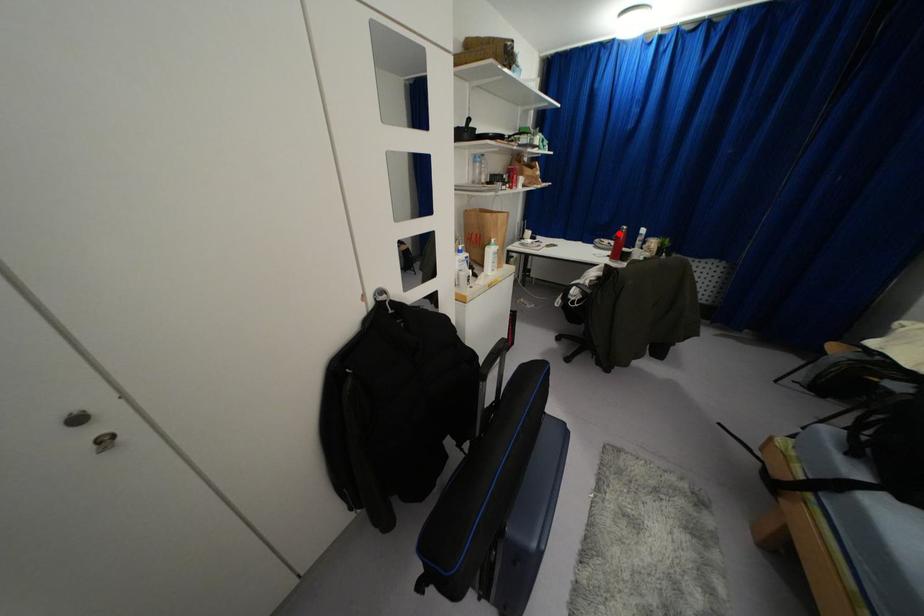
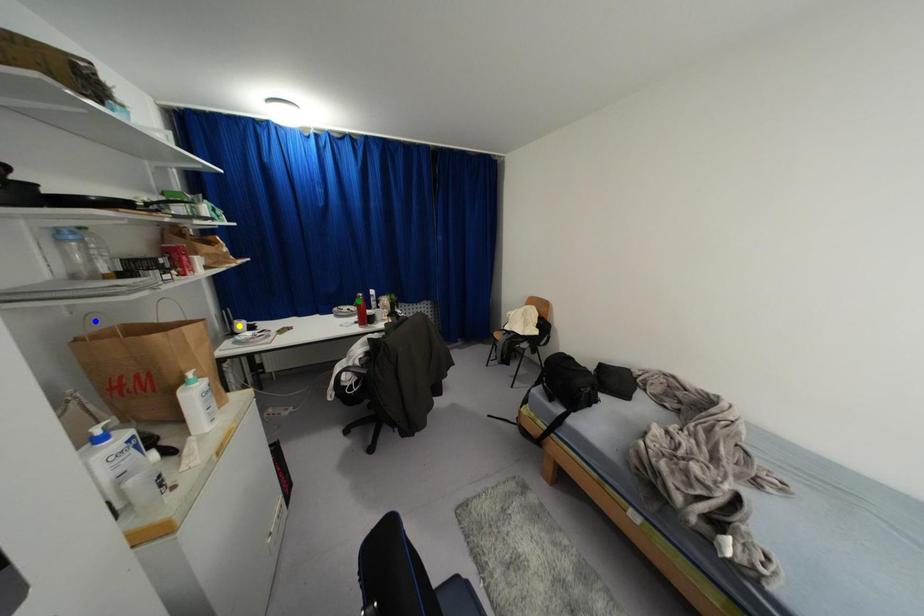
Question: I am providing you with two images of the same scene from different viewpoints. A red point is marked on the first image. You are given multiple points on the second image. Which point in image 2 is actually the same real-world point as the red point in image 1?

Choices:
 (A) blue point
 (B) yellow point
 (C) green point

Answer: (C)